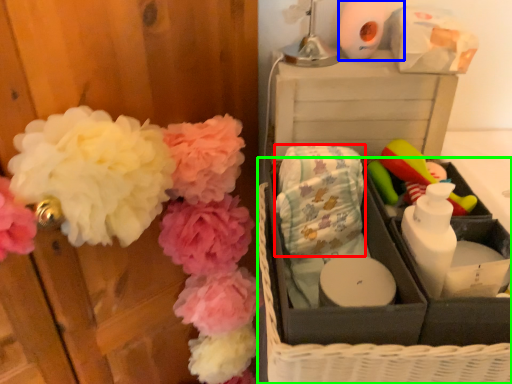
Question: Considering the real-world distances, which object is farthest from material (highlighted by a red box)? toilet paper (highlighted by a blue box) or basket (highlighted by a green box)?

Choices:
 (A) toilet paper
 (B) basket

Answer: (A)